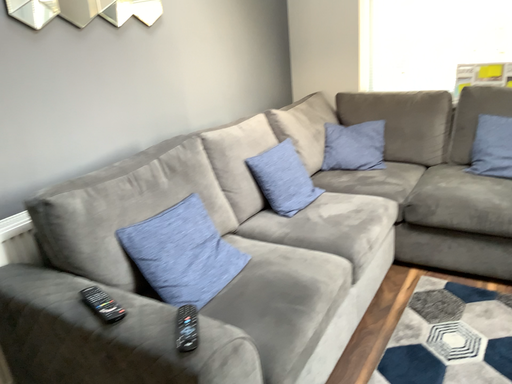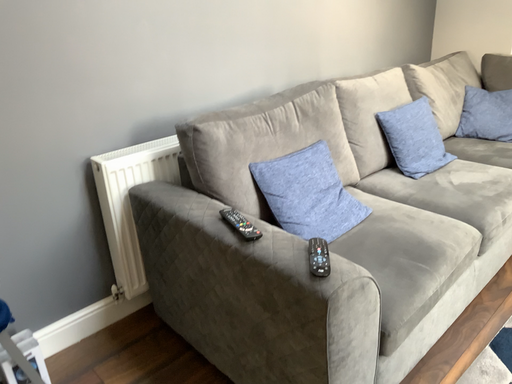
Question: How did the camera likely rotate when shooting the video?

Choices:
 (A) rotated left
 (B) rotated right

Answer: (A)